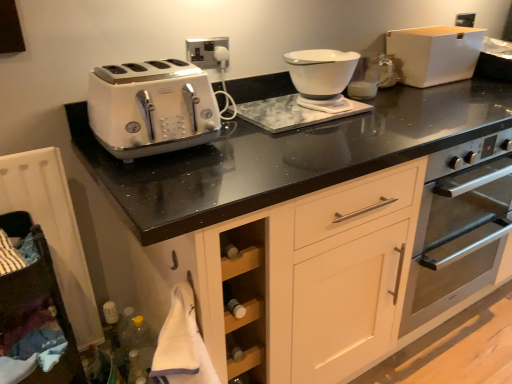
Question: Is white wood cabinet at lower left at the left side of white glossy bowl at upper center?

Choices:
 (A) yes
 (B) no

Answer: (A)

Question: From a real-world perspective, is white wood cabinet at lower left positioned under white glossy bowl at upper center based on gravity?

Choices:
 (A) no
 (B) yes

Answer: (B)

Question: Is white wood cabinet at lower left shorter than white glossy bowl at upper center?

Choices:
 (A) yes
 (B) no

Answer: (B)

Question: Is white wood cabinet at lower left in front of white glossy bowl at upper center?

Choices:
 (A) no
 (B) yes

Answer: (B)

Question: From a real-world perspective, is white wood cabinet at lower left physically above white glossy bowl at upper center?

Choices:
 (A) yes
 (B) no

Answer: (B)

Question: Can white glossy bowl at upper center be found inside white wood cabinet at lower left?

Choices:
 (A) yes
 (B) no

Answer: (B)

Question: Is white matte storage box at upper right bigger than white glossy bowl at center?

Choices:
 (A) no
 (B) yes

Answer: (B)

Question: Does white matte storage box at upper right come behind white glossy bowl at center?

Choices:
 (A) yes
 (B) no

Answer: (A)

Question: Is white matte storage box at upper right in front of white glossy bowl at center?

Choices:
 (A) yes
 (B) no

Answer: (B)

Question: Is white matte storage box at upper right far from white glossy bowl at center?

Choices:
 (A) no
 (B) yes

Answer: (A)

Question: Does white matte storage box at upper right have a lesser width compared to white glossy bowl at center?

Choices:
 (A) yes
 (B) no

Answer: (A)

Question: Are white matte storage box at upper right and white glossy bowl at center beside each other?

Choices:
 (A) yes
 (B) no

Answer: (B)

Question: Is white glossy bowl at center bigger than white glossy bowl at upper center?

Choices:
 (A) yes
 (B) no

Answer: (A)